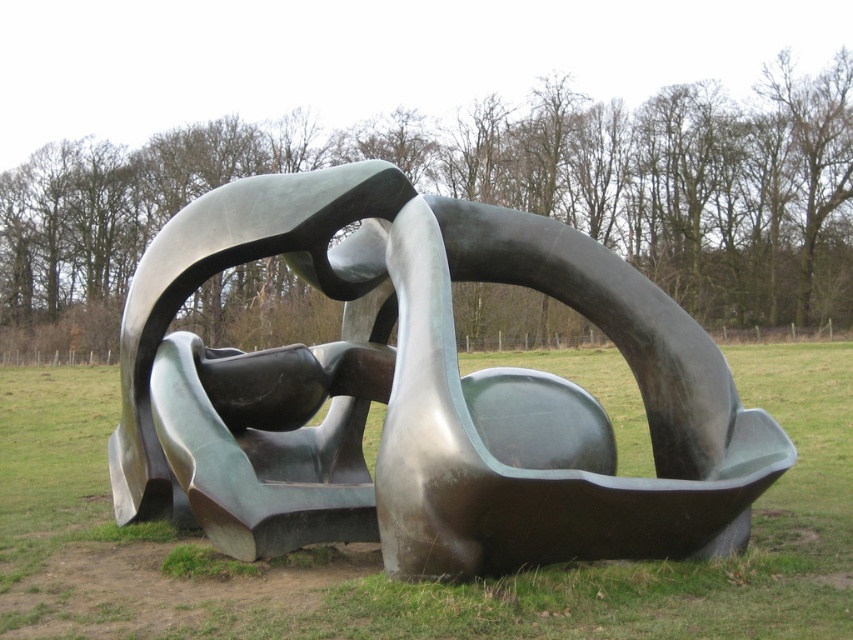
Question: Does polished bronze sculpture at center appear on the right side of bronze sculpture at center?

Choices:
 (A) yes
 (B) no

Answer: (A)

Question: Is polished bronze sculpture at center to the right of bronze sculpture at center from the viewer's perspective?

Choices:
 (A) yes
 (B) no

Answer: (A)

Question: Which object is farther from the camera taking this photo?

Choices:
 (A) bronze sculpture at center
 (B) polished bronze sculpture at center

Answer: (B)

Question: Among these points, which one is farthest from the camera?

Choices:
 (A) click(630, 348)
 (B) click(39, 369)

Answer: (B)

Question: Does polished bronze sculpture at center appear on the left side of bronze sculpture at center?

Choices:
 (A) no
 (B) yes

Answer: (A)

Question: Which object is closer to the camera taking this photo?

Choices:
 (A) polished bronze sculpture at center
 (B) bronze sculpture at center

Answer: (B)